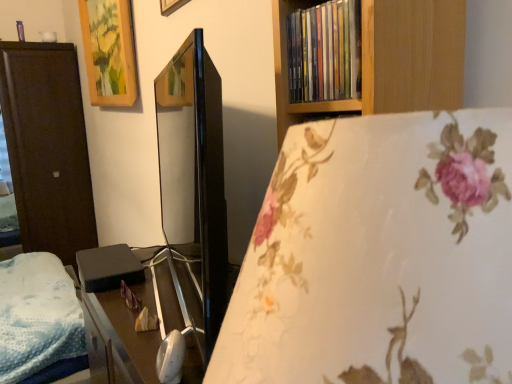
Question: Can you confirm if black matte/black box at left is thinner than dark wood wardrobe at left?

Choices:
 (A) no
 (B) yes

Answer: (B)

Question: Could you tell me if black matte/black box at left is facing dark wood wardrobe at left?

Choices:
 (A) no
 (B) yes

Answer: (A)

Question: From a real-world perspective, is black matte/black box at left positioned under dark wood wardrobe at left based on gravity?

Choices:
 (A) no
 (B) yes

Answer: (A)

Question: From the image's perspective, does black matte/black box at left appear higher than dark wood wardrobe at left?

Choices:
 (A) yes
 (B) no

Answer: (B)

Question: From the image's perspective, is black matte/black box at left below dark wood wardrobe at left?

Choices:
 (A) yes
 (B) no

Answer: (A)

Question: From the image's perspective, is wooden picture frame at upper left positioned above or below dark wood wardrobe at left?

Choices:
 (A) above
 (B) below

Answer: (A)

Question: Considering the positions of wooden picture frame at upper left and dark wood wardrobe at left in the image, is wooden picture frame at upper left wider or thinner than dark wood wardrobe at left?

Choices:
 (A) wide
 (B) thin

Answer: (B)

Question: Considering the relative positions of wooden picture frame at upper left and dark wood wardrobe at left in the image provided, is wooden picture frame at upper left to the left or to the right of dark wood wardrobe at left?

Choices:
 (A) left
 (B) right

Answer: (B)

Question: Do you think wooden picture frame at upper left is within dark wood wardrobe at left, or outside of it?

Choices:
 (A) inside
 (B) outside

Answer: (B)

Question: Is black matte/black box at left in front of or behind dark wood wardrobe at left in the image?

Choices:
 (A) behind
 (B) front

Answer: (B)

Question: Visually, is black matte/black box at left positioned to the left or to the right of dark wood wardrobe at left?

Choices:
 (A) left
 (B) right

Answer: (B)

Question: From their relative heights in the image, would you say black matte/black box at left is taller or shorter than dark wood wardrobe at left?

Choices:
 (A) short
 (B) tall

Answer: (A)

Question: Is black matte/black box at left situated inside dark wood wardrobe at left or outside?

Choices:
 (A) outside
 (B) inside

Answer: (A)

Question: From a real-world perspective, relative to black matte/black box at left, is multicolored plastic books at upper right vertically above or below?

Choices:
 (A) below
 (B) above

Answer: (B)

Question: Is multicolored plastic books at upper right bigger or smaller than black matte/black box at left?

Choices:
 (A) big
 (B) small

Answer: (B)